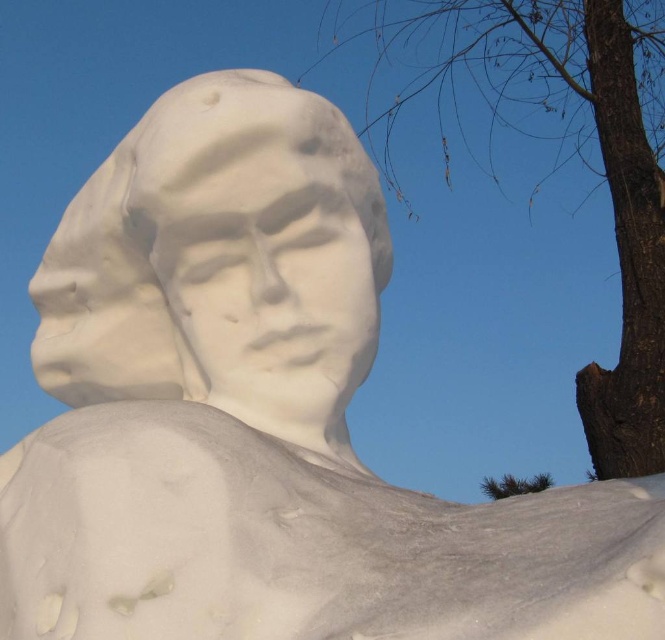
You are standing in front of the snow sculpture and want to take a photo. There are two points marked in the image at coordinates point (350, 349) and point (660, 28). Which point should you focus on to ensure the snow sculpture is in the foreground of your photo?

You should focus on point (350, 349) because it is in front of point (660, 28), placing the snow sculpture in the foreground.

You are an artist trying to place a small statue exactly between the white snow sculpture at center and the brown rough bark at upper right. Which object should you position closer to the center of the scene to ensure the statue is centered?

Since the white snow sculpture at center has a lesser width than the brown rough bark at upper right, you should position the white snow sculpture at center closer to the center of the scene to balance the statue placement.

You are an artist planning to photograph the white snow sculpture at center and the brown rough bark at upper right. Based on their heights, which object should you focus on to ensure it appears larger in the photo?

The brown rough bark at upper right is taller than the white snow sculpture at center, so focusing on it would make it appear larger in the photo.